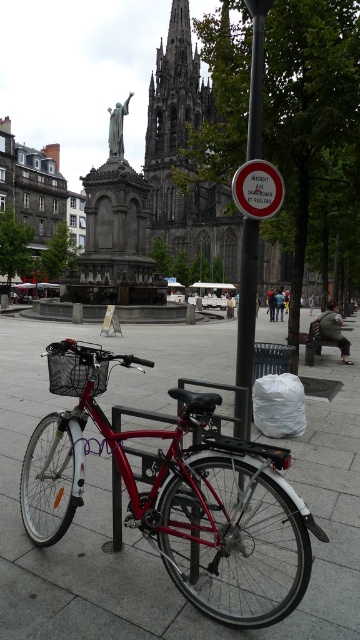
Is metallic pole at center positioned at the back of matte black basket at center?

No, metallic pole at center is in front of matte black basket at center.

Between metallic pole at center and matte black basket at center, which one has more height?

With more height is metallic pole at center.

Measure the distance between metallic pole at center and camera.

metallic pole at center and camera are 9.54 meters apart.

You are a GUI agent. You are given a task and a screenshot of the screen. Output one action in this format:
    pyautogui.click(x=<x>, y=<y>)
    Task: Click on the metallic pole at center
    The height and width of the screenshot is (640, 360).
    Given the screenshot: What is the action you would take?
    pyautogui.click(x=245, y=326)

What do you see at coordinates (177, 500) in the screenshot? I see `shiny metallic bicycle at center` at bounding box center [177, 500].

In the scene shown: Does shiny metallic bicycle at center have a greater height compared to metallic pole at center?

In fact, shiny metallic bicycle at center may be shorter than metallic pole at center.

Which is in front, point (280, 518) or point (235, 422)?

Point (280, 518)

Locate an element on the screen. The height and width of the screenshot is (640, 360). shiny metallic bicycle at center is located at coordinates (177, 500).

Is shiny metallic bicycle at center positioned in front of matte black basket at center?

Yes, shiny metallic bicycle at center is closer to the viewer.

Does shiny metallic bicycle at center appear on the left side of matte black basket at center?

No, shiny metallic bicycle at center is not to the left of matte black basket at center.

The height and width of the screenshot is (640, 360). Identify the location of shiny metallic bicycle at center. (177, 500).